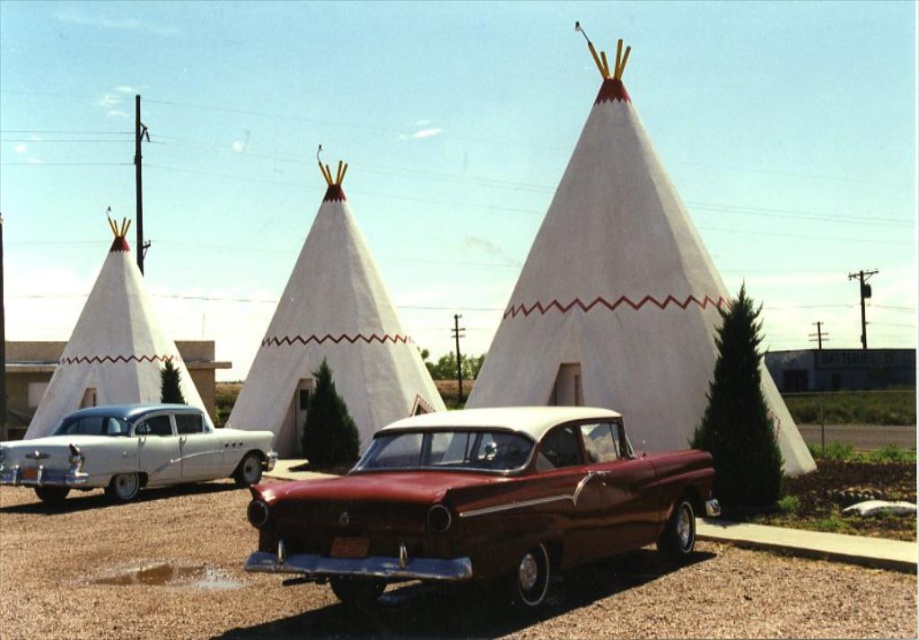
Question: Is shiny maroon sedan at center positioned behind white glossy sedan at left?

Choices:
 (A) no
 (B) yes

Answer: (A)

Question: Is shiny maroon sedan at center smaller than white fabric tent at left?

Choices:
 (A) yes
 (B) no

Answer: (A)

Question: Considering the real-world distances, which object is farthest from the white glossy sedan at left?

Choices:
 (A) white fabric tent at left
 (B) white canvas tent at center
 (C) white canvas teepee at center
 (D) shiny maroon sedan at center

Answer: (A)

Question: Among these points, which one is nearest to the camera?

Choices:
 (A) (676, 273)
 (B) (367, 416)
 (C) (67, 371)
 (D) (570, 540)

Answer: (D)

Question: Which of the following is the closest to the observer?

Choices:
 (A) white canvas tent at center
 (B) white glossy sedan at left
 (C) white canvas teepee at center

Answer: (C)

Question: Does shiny maroon sedan at center appear on the left side of white fabric tent at left?

Choices:
 (A) no
 (B) yes

Answer: (A)